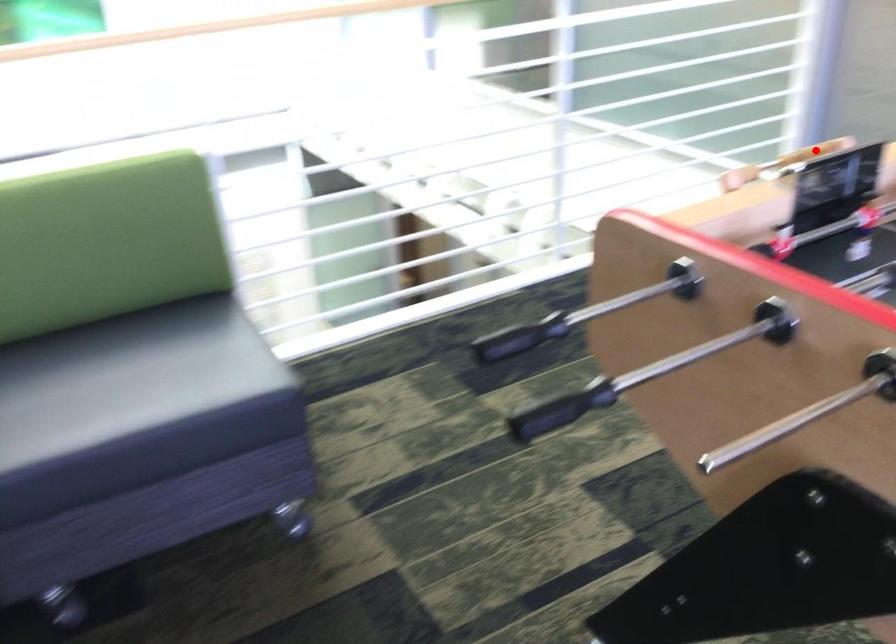
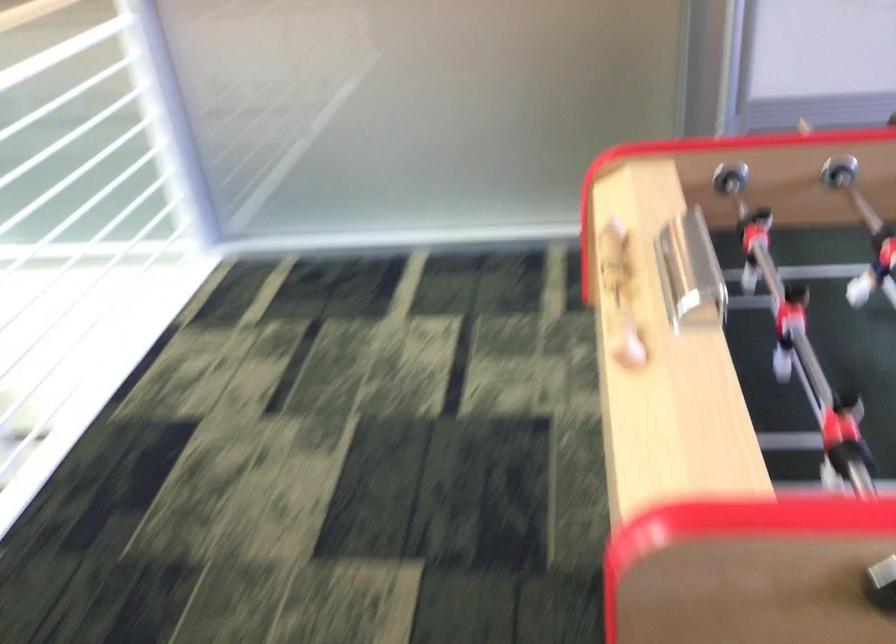
Question: I am providing you with two images of the same scene from different viewpoints. In image1, a red point is highlighted. Considering the same 3D point in image2, which of the following is correct?

Choices:
 (A) It is closer
 (B) It is farther

Answer: (A)